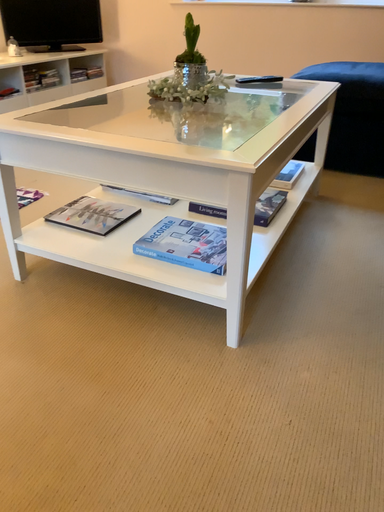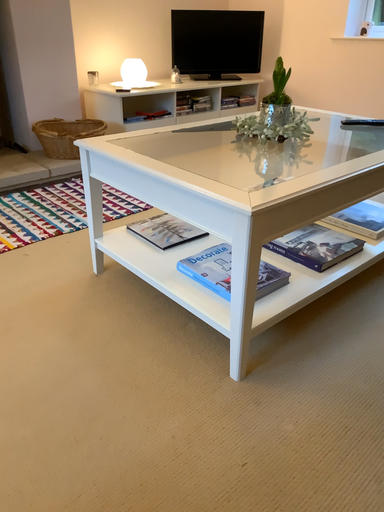
Question: Which way did the camera rotate in the video?

Choices:
 (A) rotated left
 (B) rotated right

Answer: (A)